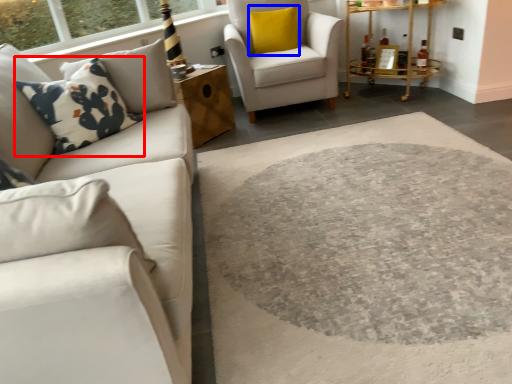
Question: Among these objects, which one is farthest to the camera, throw pillow (highlighted by a red box) or pillow (highlighted by a blue box)?

Choices:
 (A) throw pillow
 (B) pillow

Answer: (B)